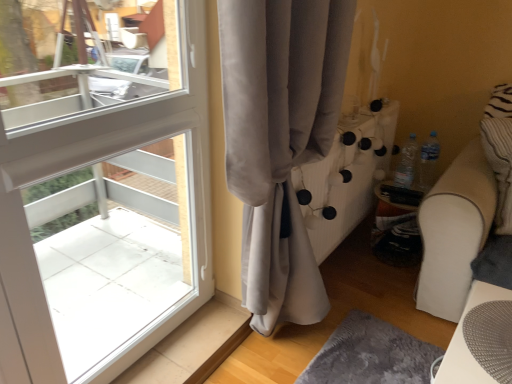
Where is `white mesh table at lower right`? The height and width of the screenshot is (384, 512). white mesh table at lower right is located at coordinates coord(465,343).

What do you see at coordinates (465, 343) in the screenshot? I see `white mesh table at lower right` at bounding box center [465, 343].

Describe the element at coordinates (280, 140) in the screenshot. Image resolution: width=512 pixels, height=384 pixels. I see `satin gray curtain at left` at that location.

Identify the location of satin gray curtain at left. (280, 140).

This screenshot has width=512, height=384. Identify the location of white mesh table at lower right. (465, 343).

Between white mesh table at lower right and satin gray curtain at left, which one appears on the left side from the viewer's perspective?

satin gray curtain at left is more to the left.

Is white mesh table at lower right in front of or behind satin gray curtain at left in the image?

white mesh table at lower right is behind satin gray curtain at left.

Is point (497, 296) positioned after point (256, 84)?

Yes, point (497, 296) is farther from viewer.

From the image's perspective, which one is positioned lower, white mesh table at lower right or satin gray curtain at left?

white mesh table at lower right, from the image's perspective.

From a real-world perspective, is white mesh table at lower right above or below satin gray curtain at left?

In terms of real-world spatial position, white mesh table at lower right is below satin gray curtain at left.

Between white mesh table at lower right and satin gray curtain at left, which one has larger width?

Wider between the two is white mesh table at lower right.

Is white mesh table at lower right taller than satin gray curtain at left?

Incorrect, the height of white mesh table at lower right is not larger of that of satin gray curtain at left.

Is white mesh table at lower right bigger or smaller than satin gray curtain at left?

Clearly, white mesh table at lower right is smaller in size than satin gray curtain at left.

Is white mesh table at lower right located outside satin gray curtain at left?

That's correct, white mesh table at lower right is outside of satin gray curtain at left.

Is the surface of white mesh table at lower right in direct contact with satin gray curtain at left?

No, white mesh table at lower right is not with satin gray curtain at left.

Is white mesh table at lower right turned away from satin gray curtain at left?

No.

This screenshot has height=384, width=512. I want to click on table that is under the satin gray curtain at left (from a real-world perspective), so click(465, 343).

Can you confirm if satin gray curtain at left is positioned to the right of white mesh table at lower right?

No.

Relative to white mesh table at lower right, is satin gray curtain at left in front or behind?

satin gray curtain at left is in front of white mesh table at lower right.

Is point (269, 166) farther from camera compared to point (488, 376)?

Yes, point (269, 166) is behind point (488, 376).

From the image's perspective, is satin gray curtain at left above or below white mesh table at lower right?

Clearly, from the image's perspective, satin gray curtain at left is above white mesh table at lower right.

From a real-world perspective, relative to white mesh table at lower right, is satin gray curtain at left vertically above or below?

From a real-world perspective, satin gray curtain at left is physically above white mesh table at lower right.

Is satin gray curtain at left wider or thinner than white mesh table at lower right?

Considering their sizes, satin gray curtain at left looks slimmer than white mesh table at lower right.

Which of these two, satin gray curtain at left or white mesh table at lower right, stands taller?

With more height is satin gray curtain at left.

Who is smaller, satin gray curtain at left or white mesh table at lower right?

white mesh table at lower right.

Choose the correct answer: Is satin gray curtain at left inside white mesh table at lower right or outside it?

satin gray curtain at left is outside white mesh table at lower right.

Is there a large distance between satin gray curtain at left and white mesh table at lower right?

That's not correct — satin gray curtain at left is a little close to white mesh table at lower right.

Does satin gray curtain at left turn towards white mesh table at lower right?

Yes, satin gray curtain at left is oriented towards white mesh table at lower right.

How different are the orientations of satin gray curtain at left and white mesh table at lower right in degrees?

88.7 degrees separate the facing orientations of satin gray curtain at left and white mesh table at lower right.

The height and width of the screenshot is (384, 512). What are the coordinates of `curtain above the white mesh table at lower right (from the image's perspective)` in the screenshot? It's located at (280, 140).

Where is `curtain on the left of white mesh table at lower right`? The height and width of the screenshot is (384, 512). curtain on the left of white mesh table at lower right is located at coordinates [x=280, y=140].

You are a GUI agent. You are given a task and a screenshot of the screen. Output one action in this format:
    pyautogui.click(x=<x>, y=<y>)
    Task: Click on the curtain lying above the white mesh table at lower right (from the image's perspective)
    The height and width of the screenshot is (384, 512).
    Given the screenshot: What is the action you would take?
    pyautogui.click(x=280, y=140)